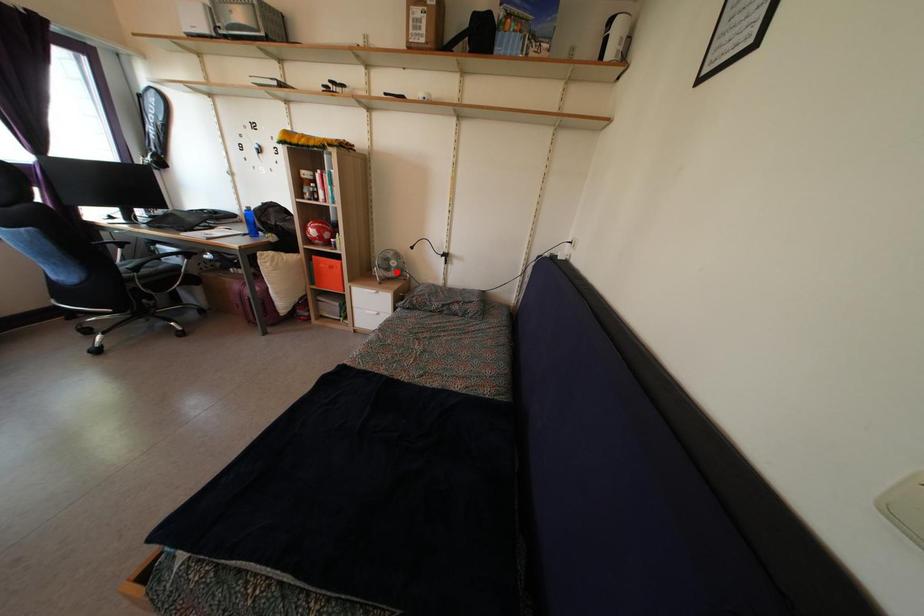
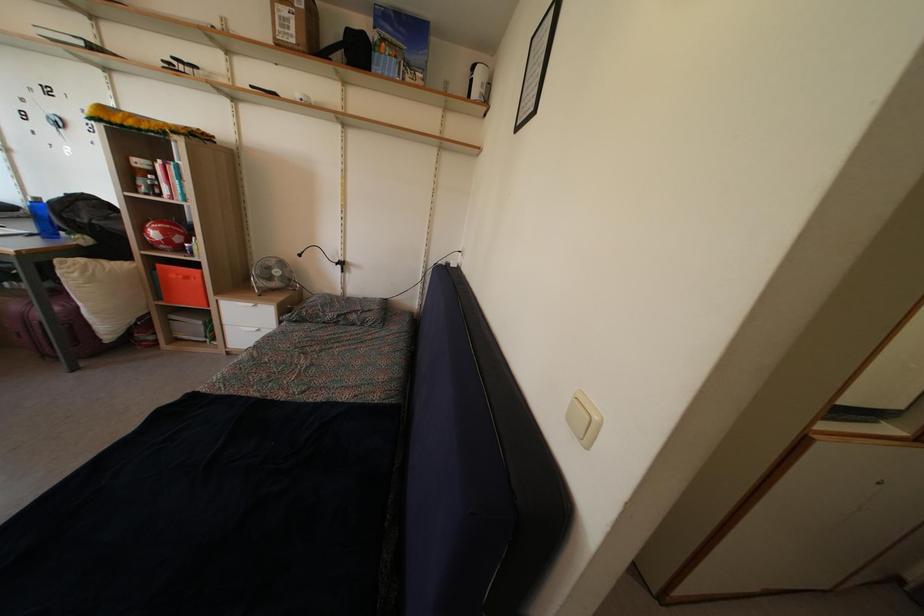
Locate, in the second image, the point that corresponds to the highlighted location in the first image.

(280, 281)